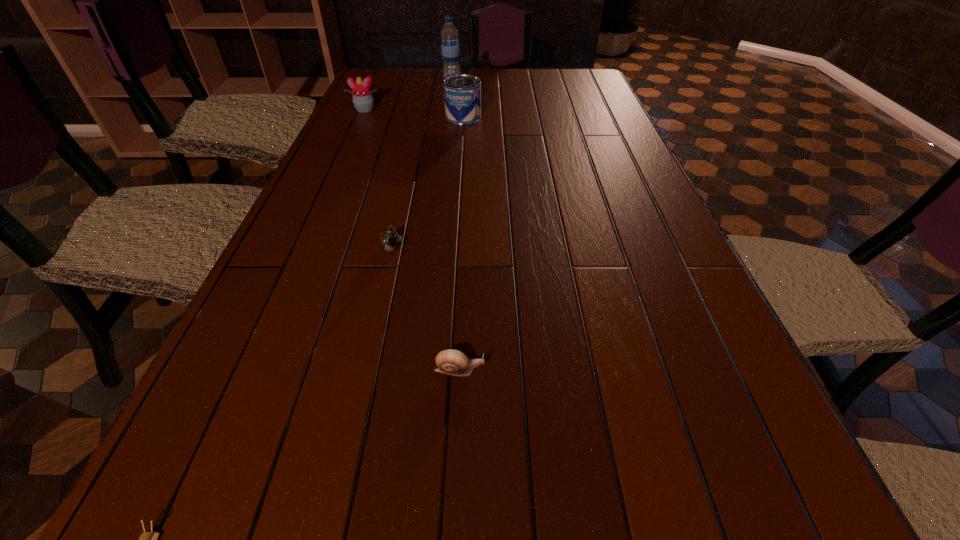
What are the coordinates of `vacant region between the third object from left to right and the cupcake` in the screenshot? It's located at (378, 180).

Locate an element on the screen. vacant space that's between the cupcake and the can is located at coordinates (414, 113).

I want to click on free space between the can and the cupcake, so click(414, 113).

Find the location of a particular element. Image resolution: width=960 pixels, height=540 pixels. vacant space that's between the second shortest escargot and the cupcake is located at coordinates (412, 240).

Locate an element on the screen. This screenshot has height=540, width=960. empty space that is in between the fourth farthest object and the second farthest escargot is located at coordinates (425, 310).

Locate which object is the third closest to the shortest escargot. Please provide its 2D coordinates. Your answer should be formatted as a tuple, i.e. [(x, y)], where the tuple contains the x and y coordinates of a point satisfying the conditions above.

[(462, 92)]

Locate which object is the fourth closest to the farthest escargot. Please provide its 2D coordinates. Your answer should be formatted as a tuple, i.e. [(x, y)], where the tuple contains the x and y coordinates of a point satisfying the conditions above.

[(363, 100)]

You are a GUI agent. You are given a task and a screenshot of the screen. Output one action in this format:
    pyautogui.click(x=<x>, y=<y>)
    Task: Click on the escargot that is the second closest to the second escargot from right to left
    
    Given the screenshot: What is the action you would take?
    pyautogui.click(x=147, y=539)

Where is `escargot that is the second nearest to the nearest object`? escargot that is the second nearest to the nearest object is located at coordinates (390, 238).

Where is `vacant space that satisfies the following two spatial constraints: 1. on the front label of the can; 2. on the face of the fourth tallest object`? Image resolution: width=960 pixels, height=540 pixels. vacant space that satisfies the following two spatial constraints: 1. on the front label of the can; 2. on the face of the fourth tallest object is located at coordinates (454, 250).